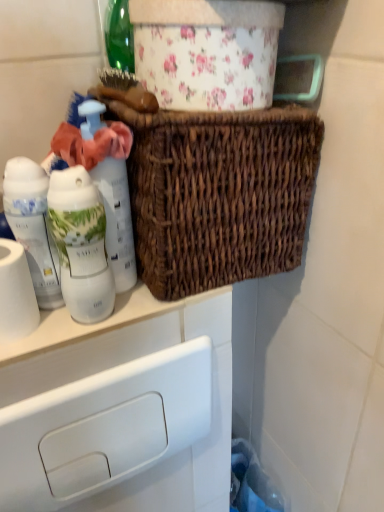
Question: Is white glossy bottle at left, arranged as the second bottle when viewed from the left, bigger than white matte toilet paper at left?

Choices:
 (A) yes
 (B) no

Answer: (B)

Question: From a real-world perspective, is white glossy bottle at left, arranged as the second bottle when viewed from the left, located beneath white matte toilet paper at left?

Choices:
 (A) no
 (B) yes

Answer: (A)

Question: Considering the relative positions of white glossy bottle at left, positioned as the second bottle in right-to-left order, and white matte toilet paper at left in the image provided, is white glossy bottle at left, positioned as the second bottle in right-to-left order, in front of white matte toilet paper at left?

Choices:
 (A) yes
 (B) no

Answer: (A)

Question: Can you confirm if white glossy bottle at left, positioned as the second bottle in right-to-left order, is shorter than white matte toilet paper at left?

Choices:
 (A) no
 (B) yes

Answer: (A)

Question: Considering the relative sizes of white glossy bottle at left, arranged as the second bottle when viewed from the left, and white matte toilet paper at left in the image provided, is white glossy bottle at left, arranged as the second bottle when viewed from the left, smaller than white matte toilet paper at left?

Choices:
 (A) yes
 (B) no

Answer: (A)

Question: From the image's perspective, does white glossy bottle at left, positioned as the second bottle in right-to-left order, appear lower than white matte toilet paper at left?

Choices:
 (A) yes
 (B) no

Answer: (B)

Question: Does woven brown basket at upper center have a smaller size compared to white glossy bottle at left, positioned as the second bottle in right-to-left order?

Choices:
 (A) no
 (B) yes

Answer: (A)

Question: Is white glossy bottle at left, positioned as the second bottle in right-to-left order, located within woven brown basket at upper center?

Choices:
 (A) no
 (B) yes

Answer: (A)

Question: Does woven brown basket at upper center have a greater width compared to white glossy bottle at left, positioned as the second bottle in right-to-left order?

Choices:
 (A) yes
 (B) no

Answer: (A)

Question: Is woven brown basket at upper center completely or partially outside of white glossy bottle at left, positioned as the second bottle in right-to-left order?

Choices:
 (A) yes
 (B) no

Answer: (A)

Question: Is woven brown basket at upper center not near white glossy bottle at left, positioned as the second bottle in right-to-left order?

Choices:
 (A) yes
 (B) no

Answer: (B)

Question: Could you tell me if woven brown basket at upper center is facing white glossy bottle at left, arranged as the second bottle when viewed from the left?

Choices:
 (A) yes
 (B) no

Answer: (B)

Question: Is white glossy bottle at left, arranged as the second bottle when viewed from the left, not within woven brown basket at upper center?

Choices:
 (A) yes
 (B) no

Answer: (A)